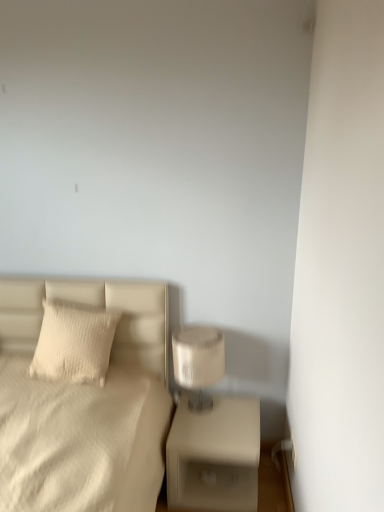
Measure the distance between point [222,444] and camera.

The distance of point [222,444] from camera is 1.90 meters.

The height and width of the screenshot is (512, 384). I want to click on beige matte nightstand at lower right, so click(x=214, y=456).

Can you tell me how much white textured pillow at left and satin beige lampshade at right differ in facing direction?

The facing directions of white textured pillow at left and satin beige lampshade at right are 0.496 degrees apart.

Is white textured pillow at left at the left side of satin beige lampshade at right?

Correct, you'll find white textured pillow at left to the left of satin beige lampshade at right.

From a real-world perspective, is white textured pillow at left located higher than satin beige lampshade at right?

Correct, in the physical world, white textured pillow at left is higher than satin beige lampshade at right.

Is satin beige lampshade at right turned away from white textured pillow at left?

No, white textured pillow at left is not at the back of satin beige lampshade at right.

From a real-world perspective, is satin beige lampshade at right below white textured pillow at left?

Yes, from a real-world perspective, satin beige lampshade at right is below white textured pillow at left.

Is satin beige lampshade at right not inside white textured pillow at left?

Indeed, satin beige lampshade at right is completely outside white textured pillow at left.

Between satin beige lampshade at right and white textured pillow at left, which one appears on the left side from the viewer's perspective?

From the viewer's perspective, white textured pillow at left appears more on the left side.

Considering the sizes of objects white textured pillow at left and beige matte nightstand at lower right in the image provided, who is shorter, white textured pillow at left or beige matte nightstand at lower right?

white textured pillow at left is shorter.

Considering the relative sizes of white textured pillow at left and beige matte nightstand at lower right in the image provided, is white textured pillow at left thinner than beige matte nightstand at lower right?

Indeed, white textured pillow at left has a lesser width compared to beige matte nightstand at lower right.

Is white textured pillow at left far from beige matte nightstand at lower right?

No, there isn't a large distance between white textured pillow at left and beige matte nightstand at lower right.

Would you say beige matte nightstand at lower right is part of white textured pillow at left's contents?

That's incorrect, beige matte nightstand at lower right is not inside white textured pillow at left.

Is white textured bed at left turned away from beige matte nightstand at lower right?

No.

Choose the correct answer: Is white textured bed at left inside beige matte nightstand at lower right or outside it?

white textured bed at left is spatially situated outside beige matte nightstand at lower right.

From the image's perspective, who appears lower, white textured bed at left or beige matte nightstand at lower right?

beige matte nightstand at lower right appears lower in the image.

Does white textured bed at left have a smaller size compared to beige matte nightstand at lower right?

Incorrect, white textured bed at left is not smaller in size than beige matte nightstand at lower right.

Looking at this image, which is correct: beige matte nightstand at lower right is inside white textured pillow at left, or outside of it?

beige matte nightstand at lower right is not enclosed by white textured pillow at left.

In the image, is beige matte nightstand at lower right positioned in front of or behind white textured pillow at left?

Clearly, beige matte nightstand at lower right is in front of white textured pillow at left.

Is point (229, 469) farther from camera compared to point (90, 338)?

That is True.

You are a GUI agent. You are given a task and a screenshot of the screen. Output one action in this format:
    pyautogui.click(x=<x>, y=<y>)
    Task: Click on the nightstand on the right of the white textured pillow at left
    The height and width of the screenshot is (512, 384).
    Given the screenshot: What is the action you would take?
    pyautogui.click(x=214, y=456)

From a real-world perspective, which object rests below the other?

white textured bed at left, from a real-world perspective.

Consider the image. Is satin beige lampshade at right facing towards white textured bed at left?

No, satin beige lampshade at right is not aimed at white textured bed at left.

Looking at this image, is satin beige lampshade at right at the right side of white textured bed at left?

Yes, satin beige lampshade at right is to the right of white textured bed at left.

Does satin beige lampshade at right have a smaller size compared to white textured bed at left?

Yes.

From the image's perspective, is white textured pillow at left on white textured bed at left?

Yes, from the image's perspective, white textured pillow at left is over white textured bed at left.

Does point (94, 342) come closer to viewer compared to point (17, 312)?

Yes, it is in front of point (17, 312).

Does white textured pillow at left have a lesser height compared to white textured bed at left?

Correct, white textured pillow at left is not as tall as white textured bed at left.

The image size is (384, 512). Identify the location of bed that appears on the left of white textured pillow at left. (84, 405).

Locate an element on the screen. This screenshot has height=512, width=384. pillow behind the satin beige lampshade at right is located at coordinates (74, 342).

This screenshot has height=512, width=384. In order to click on table lamp in front of the white textured pillow at left in this screenshot , I will do `click(197, 364)`.

When comparing their distances from beige matte nightstand at lower right, does satin beige lampshade at right or white textured pillow at left seem further?

Based on the image, white textured pillow at left appears to be further to beige matte nightstand at lower right.

Looking at the image, which one is located further to white textured pillow at left, satin beige lampshade at right or white textured bed at left?

satin beige lampshade at right lies further to white textured pillow at left than the other object.

When comparing their distances from white textured bed at left, does satin beige lampshade at right or beige matte nightstand at lower right seem closer?

The object closer to white textured bed at left is satin beige lampshade at right.

Which object lies nearer to the anchor point white textured pillow at left, beige matte nightstand at lower right or satin beige lampshade at right?

satin beige lampshade at right lies closer to white textured pillow at left than the other object.

In the scene shown: Which object lies further to the anchor point satin beige lampshade at right, white textured bed at left or beige matte nightstand at lower right?

white textured bed at left is further to satin beige lampshade at right.

Consider the image. Estimate the real-world distances between objects in this image. Which object is closer to beige matte nightstand at lower right, white textured pillow at left or satin beige lampshade at right?

The object closer to beige matte nightstand at lower right is satin beige lampshade at right.

Consider the image. Considering their positions, is satin beige lampshade at right positioned closer to white textured pillow at left than beige matte nightstand at lower right?

Based on the image, satin beige lampshade at right appears to be nearer to white textured pillow at left.

Which object lies further to the anchor point white textured bed at left, beige matte nightstand at lower right or satin beige lampshade at right?

beige matte nightstand at lower right lies further to white textured bed at left than the other object.

The height and width of the screenshot is (512, 384). I want to click on table lamp between white textured pillow at left and beige matte nightstand at lower right, so click(x=197, y=364).

Where is `table lamp located between white textured bed at left and white textured pillow at left in the depth direction`? This screenshot has width=384, height=512. table lamp located between white textured bed at left and white textured pillow at left in the depth direction is located at coordinates (197, 364).

Where is `nightstand between white textured bed at left and white textured pillow at left from front to back`? The width and height of the screenshot is (384, 512). nightstand between white textured bed at left and white textured pillow at left from front to back is located at coordinates (214, 456).

The height and width of the screenshot is (512, 384). Find the location of `nightstand between white textured bed at left and satin beige lampshade at right in the front-back direction`. nightstand between white textured bed at left and satin beige lampshade at right in the front-back direction is located at coordinates (214, 456).